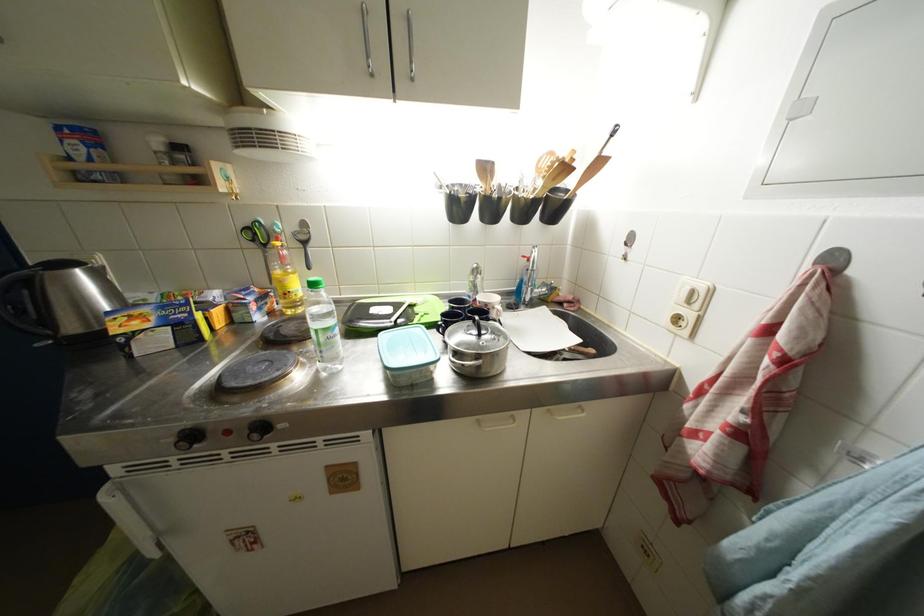
The image size is (924, 616). I want to click on faucet handle, so click(x=550, y=284).